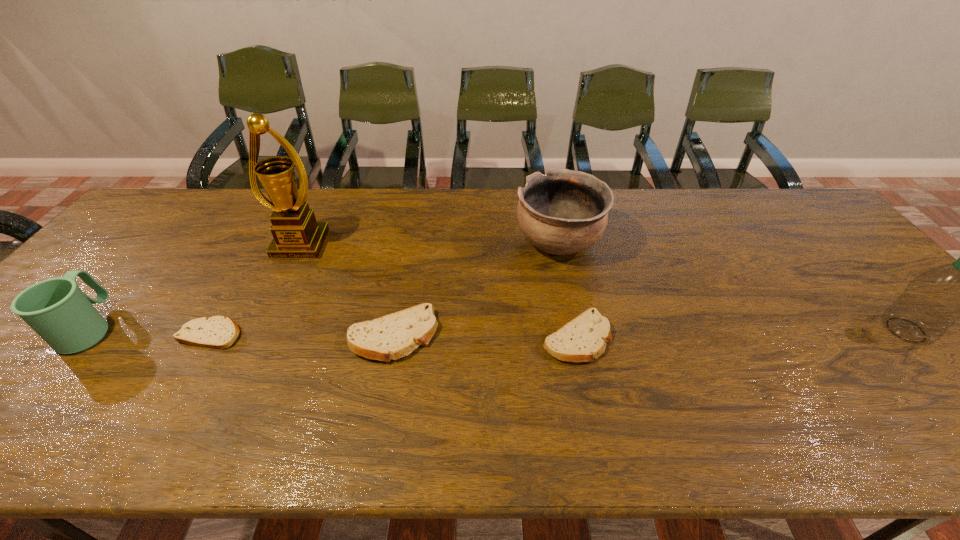
The image size is (960, 540). Identify the location of the shortest pita bread. (220, 332).

You are a GUI agent. You are given a task and a screenshot of the screen. Output one action in this format:
    pyautogui.click(x=<x>, y=<y>)
    Task: Click on the shortest object
    
    Given the screenshot: What is the action you would take?
    pyautogui.click(x=220, y=332)

Identify the location of the second pita bread from right to left. (393, 336).

Locate an element on the screen. The width and height of the screenshot is (960, 540). the third shortest object is located at coordinates (393, 336).

Where is `the rightmost pita bread`? the rightmost pita bread is located at coordinates (584, 338).

You are a GUI agent. You are given a task and a screenshot of the screen. Output one action in this format:
    pyautogui.click(x=<x>, y=<y>)
    Task: Click on the sixth tallest object
    
    Given the screenshot: What is the action you would take?
    pyautogui.click(x=584, y=338)

What are the coordinates of `the leftmost object` in the screenshot? It's located at (57, 309).

Find the location of a particular element. mug is located at coordinates (57, 309).

Image resolution: width=960 pixels, height=540 pixels. I want to click on the third tallest object, so click(563, 212).

Locate an element on the screen. This screenshot has height=540, width=960. the tallest object is located at coordinates (296, 234).